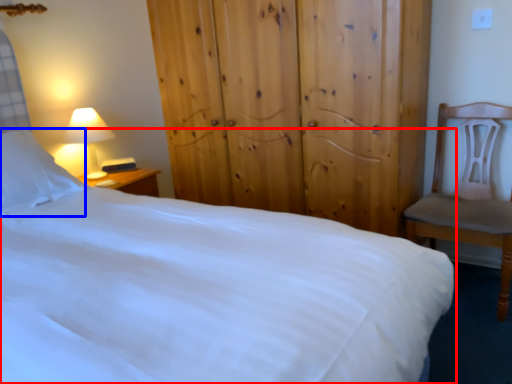
Question: Which of the following is the closest to the observer, bed (highlighted by a red box) or pillow (highlighted by a blue box)?

Choices:
 (A) bed
 (B) pillow

Answer: (A)